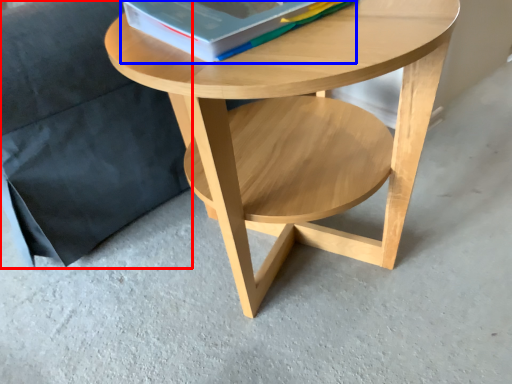
Question: Which of the following is the farthest to the observer, armchair (highlighted by a red box) or paperback book (highlighted by a blue box)?

Choices:
 (A) armchair
 (B) paperback book

Answer: (A)